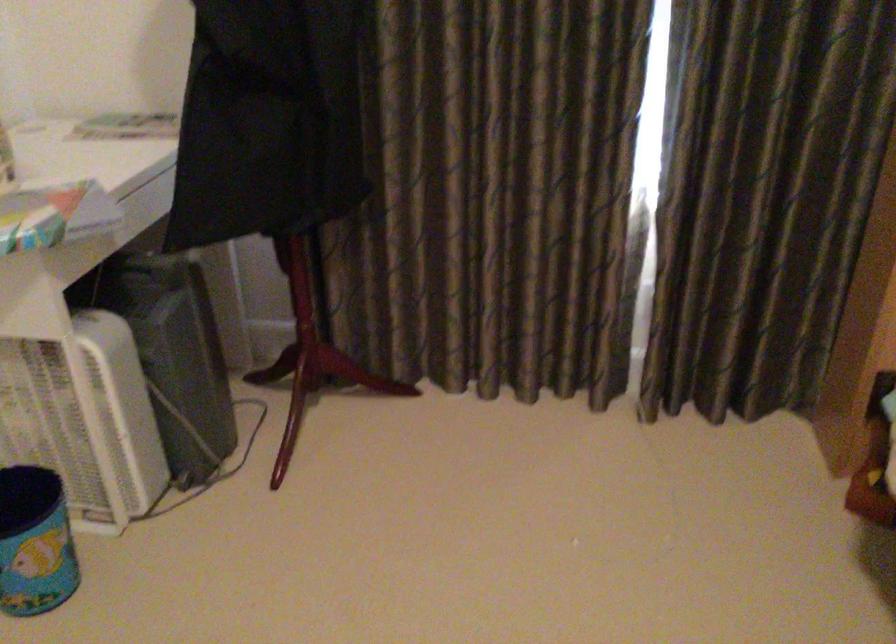
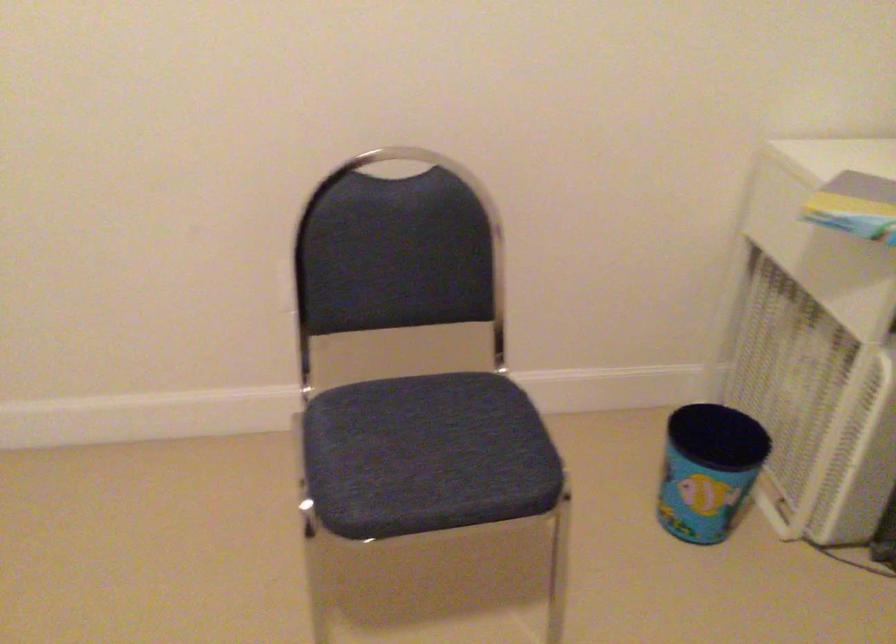
The images are taken continuously from a first-person perspective. In which direction is your viewpoint rotating?

The camera's rotation is toward left-down.